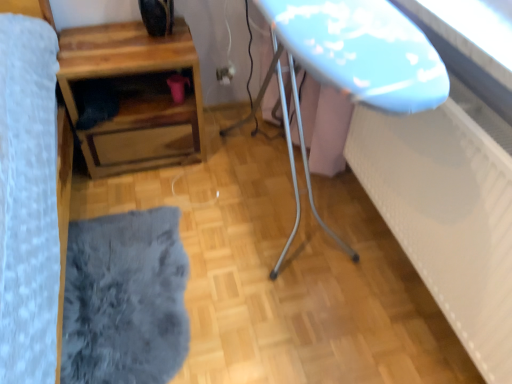
What do you see at coordinates (225, 74) in the screenshot? This screenshot has height=384, width=512. I see `matte plastic outlet at center` at bounding box center [225, 74].

Measure the distance between matte plastic outlet at center and camera.

matte plastic outlet at center is 2.27 meters away from camera.

Image resolution: width=512 pixels, height=384 pixels. Find the location of `fuzzy gray rug at lower left`. fuzzy gray rug at lower left is located at coordinates (125, 299).

How far apart are wooden table at lower left and matte plastic outlet at center?

The distance of wooden table at lower left from matte plastic outlet at center is 22.65 inches.

Does wooden table at lower left have a lesser height compared to matte plastic outlet at center?

Incorrect, the height of wooden table at lower left does not fall short of that of matte plastic outlet at center.

From the image's perspective, is wooden table at lower left beneath matte plastic outlet at center?

Yes.

Is wooden table at lower left looking in the opposite direction of matte plastic outlet at center?

No, wooden table at lower left's orientation is not away from matte plastic outlet at center.

The image size is (512, 384). In order to click on flat lying on the right of wooden table at lower left in this screenshot , I will do `click(125, 299)`.

Is fuzzy gray rug at lower left in front of or behind wooden table at lower left in the image?

fuzzy gray rug at lower left is in front of wooden table at lower left.

How distant is fuzzy gray rug at lower left from wooden table at lower left?

fuzzy gray rug at lower left and wooden table at lower left are 24.94 inches apart from each other.

From the image's perspective, which is above, fuzzy gray rug at lower left or wooden table at lower left?

wooden table at lower left appears higher in the image.

Would you say matte plastic outlet at center is to the left or to the right of wooden table at lower left in the picture?

In the image, matte plastic outlet at center appears on the right side of wooden table at lower left.

Which is correct: matte plastic outlet at center is inside wooden table at lower left, or outside of it?

matte plastic outlet at center cannot be found inside wooden table at lower left.

In order to click on electric outlet located behind the wooden table at lower left in this screenshot , I will do point(225,74).

Can you see matte plastic outlet at center touching wooden table at lower left?

matte plastic outlet at center and wooden table at lower left are not in contact.

Can you tell me how much fuzzy gray rug at lower left and matte plastic outlet at center differ in facing direction?

The angular difference between fuzzy gray rug at lower left and matte plastic outlet at center is 89.3 degrees.

From the image's perspective, which is above, fuzzy gray rug at lower left or matte plastic outlet at center?

From the image's view, matte plastic outlet at center is above.

At what (x,y) coordinates should I click in order to perform the action: click on electric outlet above the fuzzy gray rug at lower left (from the image's perspective). Please return your answer as a coordinate pair (x, y). Looking at the image, I should click on (225, 74).

Does fuzzy gray rug at lower left have a larger size compared to matte plastic outlet at center?

Correct, fuzzy gray rug at lower left is larger in size than matte plastic outlet at center.

Are wooden table at lower left and fuzzy gray rug at lower left beside each other?

No, wooden table at lower left is not touching fuzzy gray rug at lower left.

Identify the location of table that appears above the fuzzy gray rug at lower left (from the image's perspective). Image resolution: width=512 pixels, height=384 pixels. 135,96.

From their relative heights in the image, would you say wooden table at lower left is taller or shorter than fuzzy gray rug at lower left?

In the image, wooden table at lower left appears to be taller than fuzzy gray rug at lower left.

Considering the sizes of wooden table at lower left and fuzzy gray rug at lower left in the image, is wooden table at lower left bigger or smaller than fuzzy gray rug at lower left?

Clearly, wooden table at lower left is larger in size than fuzzy gray rug at lower left.

Which is farther from the camera, [232,69] or [99,374]?

Positioned behind is point [232,69].

Which is more to the left, matte plastic outlet at center or fuzzy gray rug at lower left?

fuzzy gray rug at lower left.

Which is correct: matte plastic outlet at center is inside fuzzy gray rug at lower left, or outside of it?

The correct answer is: outside.

Is the surface of matte plastic outlet at center in direct contact with fuzzy gray rug at lower left?

matte plastic outlet at center is not next to fuzzy gray rug at lower left, and they're not touching.

What are the coordinates of `table in front of the matte plastic outlet at center` in the screenshot? It's located at pos(135,96).

What are the coordinates of `table on the left of fuzzy gray rug at lower left` in the screenshot? It's located at (135, 96).

Based on their spatial positions, is matte plastic outlet at center or wooden table at lower left closer to fuzzy gray rug at lower left?

Among the two, wooden table at lower left is located nearer to fuzzy gray rug at lower left.

When comparing their distances from matte plastic outlet at center, does fuzzy gray rug at lower left or wooden table at lower left seem closer?

The object closer to matte plastic outlet at center is wooden table at lower left.

From the image, which object appears to be farther from fuzzy gray rug at lower left, wooden table at lower left or matte plastic outlet at center?

matte plastic outlet at center is positioned further to the anchor fuzzy gray rug at lower left.

Considering their positions, is wooden table at lower left positioned further to matte plastic outlet at center than fuzzy gray rug at lower left?

fuzzy gray rug at lower left is further to matte plastic outlet at center.

Which object lies nearer to the anchor point wooden table at lower left, fuzzy gray rug at lower left or matte plastic outlet at center?

matte plastic outlet at center is closer to wooden table at lower left.

Considering their positions, is matte plastic outlet at center positioned closer to wooden table at lower left than fuzzy gray rug at lower left?

The object closer to wooden table at lower left is matte plastic outlet at center.

Identify the location of table between matte plastic outlet at center and fuzzy gray rug at lower left in the vertical direction. Image resolution: width=512 pixels, height=384 pixels. (135, 96).